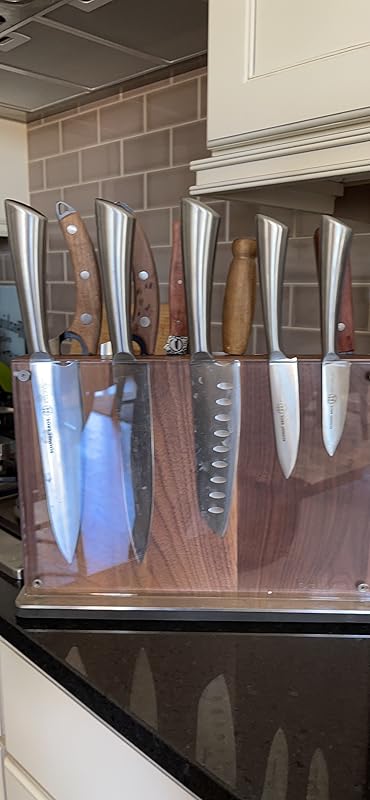
The image size is (370, 800). What are the coordinates of `white cabinet` in the screenshot? It's located at (285, 45).